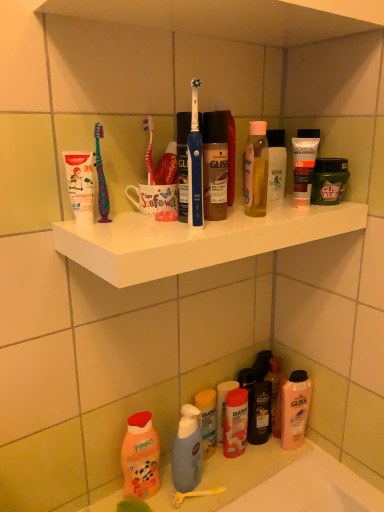
What are the coordinates of `blank space to the left of blue plastic toothbrush at center` in the screenshot? It's located at tap(128, 230).